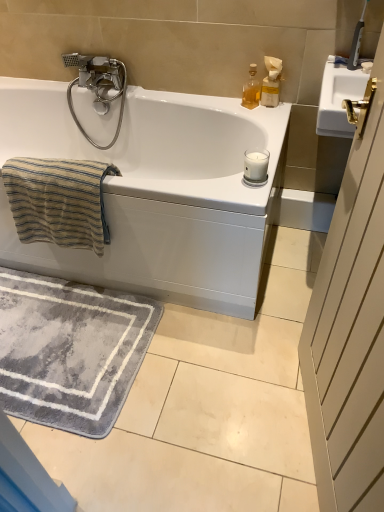
The width and height of the screenshot is (384, 512). Identify the location of free space in front of translucent glass bottle at upper right, which appears as the 2th soap dispenser when viewed from the right. (259, 116).